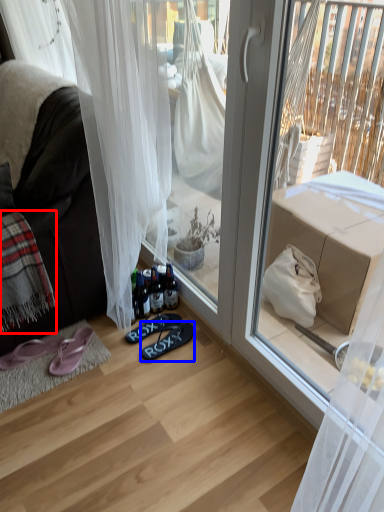
Question: Which of the following is the closest to the observer, blanket (highlighted by a red box) or footwear (highlighted by a blue box)?

Choices:
 (A) blanket
 (B) footwear

Answer: (A)